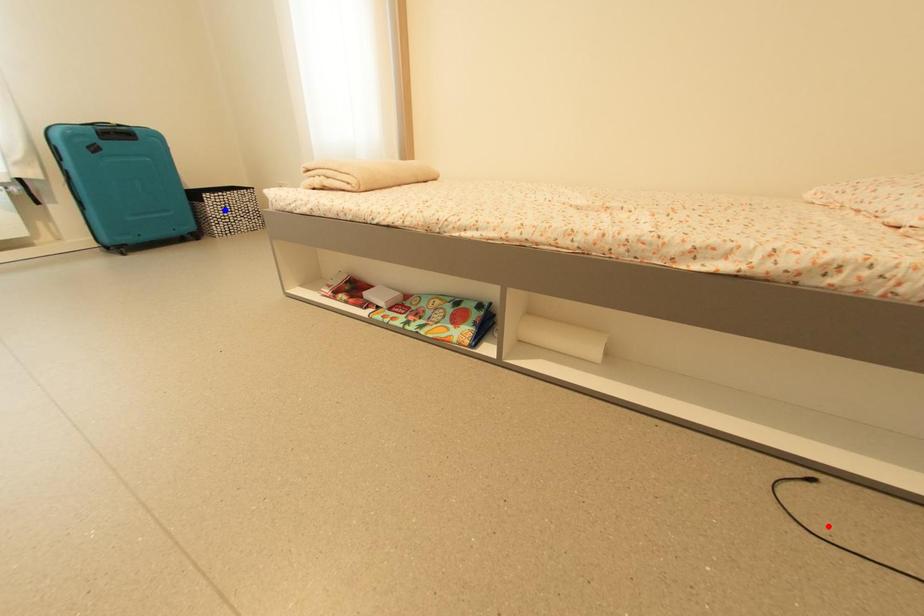
Question: Which of the two points in the image is closer to the camera?

Choices:
 (A) Blue point is closer.
 (B) Red point is closer.

Answer: (B)